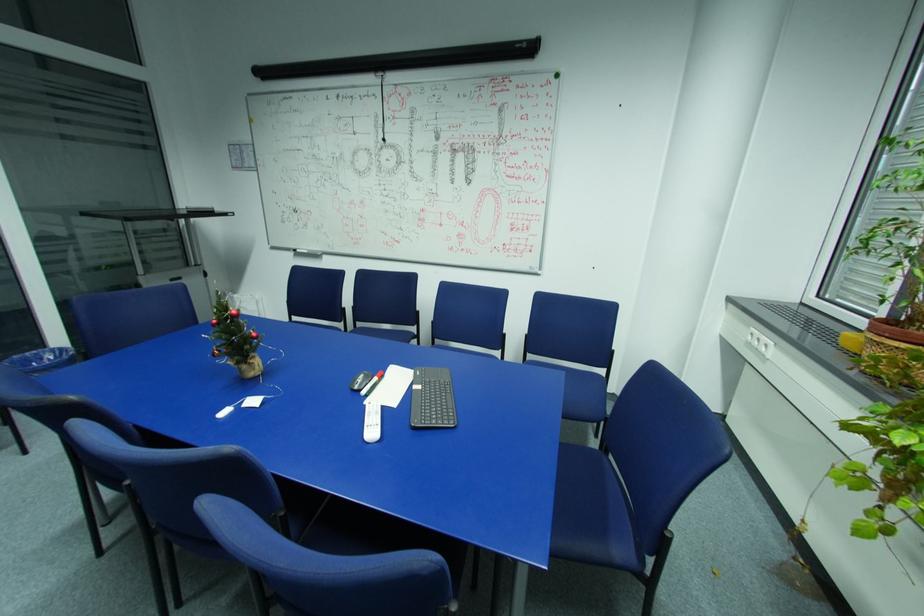
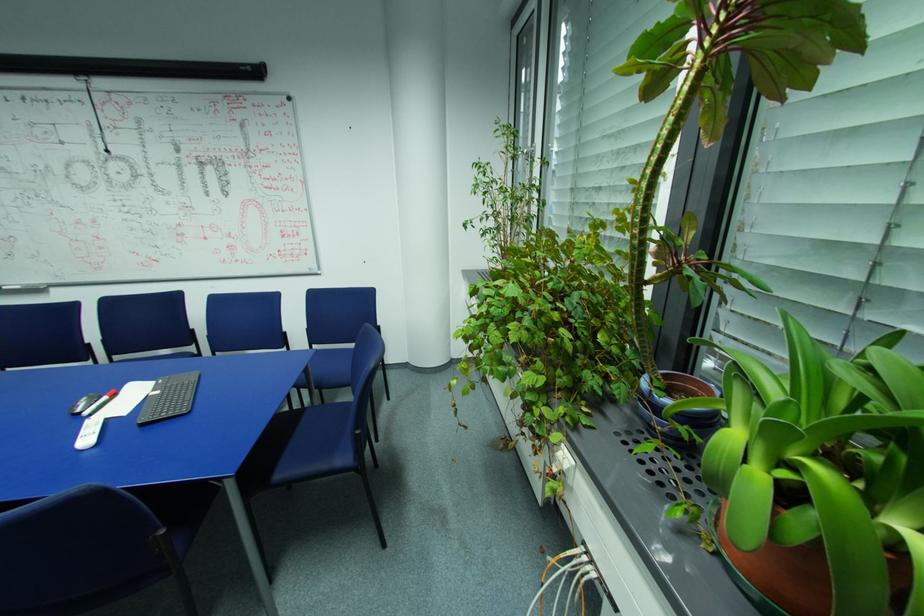
In a continuous first-person perspective shot, in which direction is the camera moving?

The cameraman moved toward right, backward.